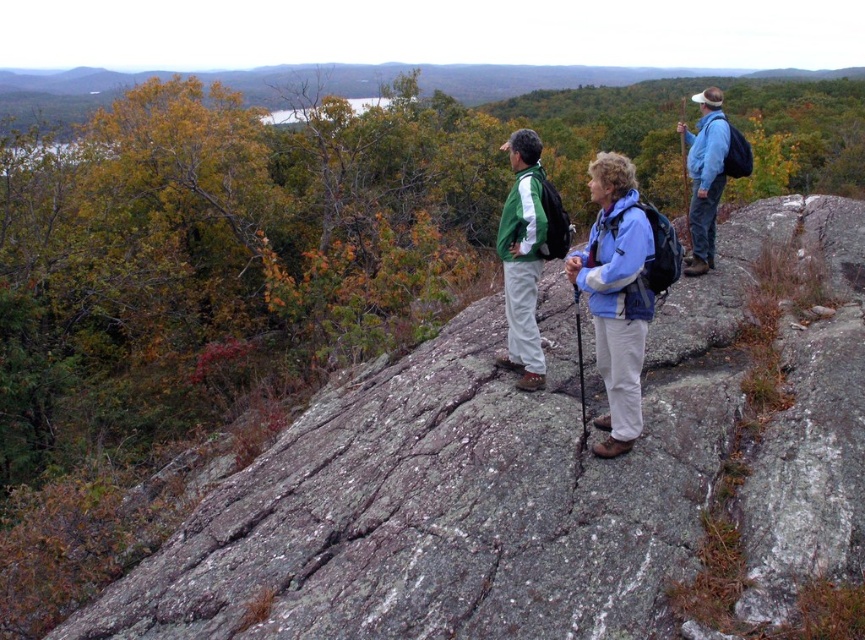
Question: Estimate the real-world distances between objects in this image. Which object is farther from the blue fabric jacket at upper right?

Choices:
 (A) blue fabric jacket at center
 (B) matte blue jacket at center

Answer: (A)

Question: Based on their relative distances, which object is nearer to the gray rough rock at center?

Choices:
 (A) blue fabric jacket at center
 (B) green fleece jacket at center
 (C) matte blue jacket at center
 (D) blue fabric jacket at upper right

Answer: (A)

Question: Estimate the real-world distances between objects in this image. Which object is farther from the matte blue jacket at center?

Choices:
 (A) blue fabric jacket at upper right
 (B) gray rough rock at center
 (C) blue fabric jacket at center
 (D) green fleece jacket at center

Answer: (B)

Question: Where is matte blue jacket at center located in relation to green fleece jacket at center in the image?

Choices:
 (A) left
 (B) right

Answer: (B)

Question: Can you confirm if matte blue jacket at center is positioned below green fleece jacket at center?

Choices:
 (A) yes
 (B) no

Answer: (B)

Question: Is gray rough rock at center bigger than blue fabric jacket at center?

Choices:
 (A) yes
 (B) no

Answer: (B)